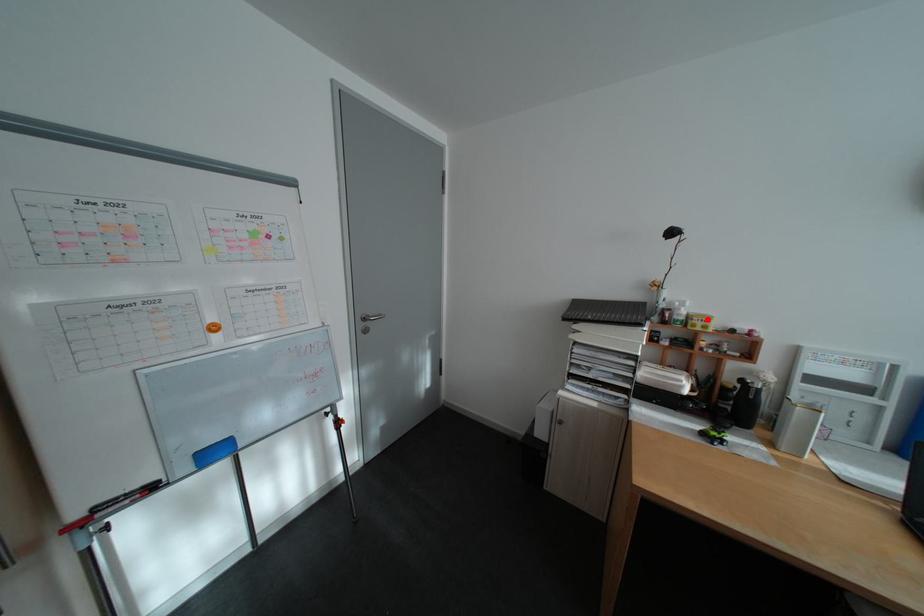
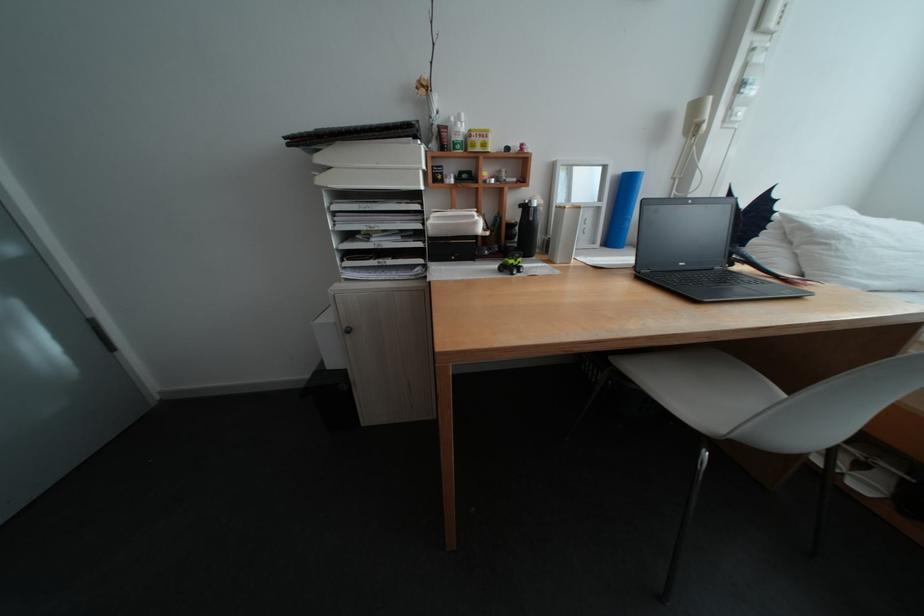
Question: A red point is marked in image1. In image2, is the corresponding 3D point closer to the camera or farther? Reply with the corresponding letter.

Choices:
 (A) The corresponding 3D point is closer.
 (B) The corresponding 3D point is farther.

Answer: (A)